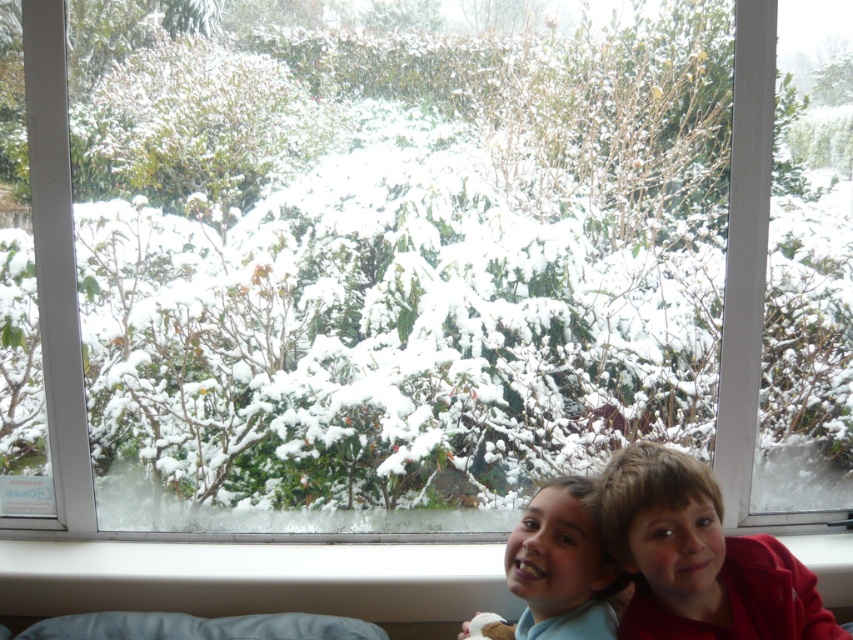
You are a parent trying to ensure your children are safe while they play near the window. The white plastic window sill at lower center and the smooth skin child at lower center are in the scene. Which object is positioned lower in the image?

The white plastic window sill at lower center is positioned below the smooth skin child at lower center, so it is lower in the image.

You are trying to place a small potted plant on the white plastic window sill at lower center. The plant requires a space that is at least as large as the smooth skin child at lower center. Will the window sill provide enough space?

The white plastic window sill at lower center is bigger than the smooth skin child at lower center, so yes, the window sill can accommodate the plant as it is large enough to hold an object the size of the smooth skin child at lower center.